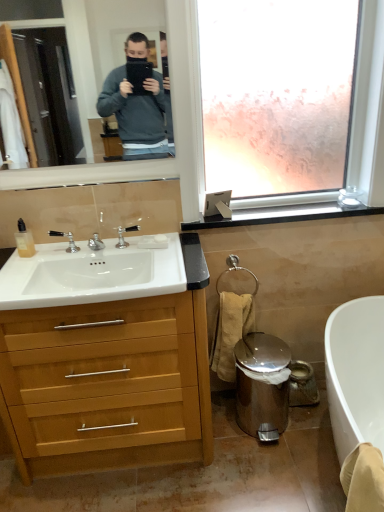
You are a GUI agent. You are given a task and a screenshot of the screen. Output one action in this format:
    pyautogui.click(x=<x>, y=<y>)
    Task: Click on the free point in front of polished stainless steel trash can at lower right
    
    Given the screenshot: What is the action you would take?
    pyautogui.click(x=271, y=470)